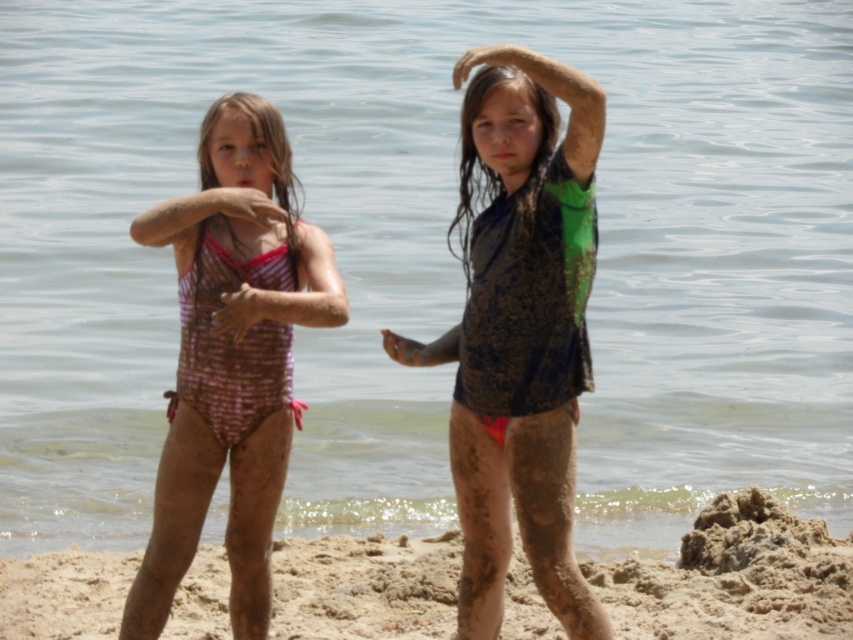
Can you confirm if shiny green and black swimsuit at center is positioned above fine-grained sand at lower center?

Indeed, shiny green and black swimsuit at center is positioned over fine-grained sand at lower center.

At what (x,y) coordinates should I click in order to perform the action: click on shiny green and black swimsuit at center. Please return your answer as a coordinate pair (x, y). Image resolution: width=853 pixels, height=640 pixels. Looking at the image, I should click on (520, 330).

This screenshot has width=853, height=640. Describe the element at coordinates (520, 330) in the screenshot. I see `shiny green and black swimsuit at center` at that location.

Image resolution: width=853 pixels, height=640 pixels. Identify the location of shiny green and black swimsuit at center. (520, 330).

Image resolution: width=853 pixels, height=640 pixels. What do you see at coordinates (735, 577) in the screenshot?
I see `fine-grained sand at lower center` at bounding box center [735, 577].

Is fine-grained sand at lower center behind pink checkered swimsuit at center?

Yes, fine-grained sand at lower center is behind pink checkered swimsuit at center.

Describe the element at coordinates (735, 577) in the screenshot. I see `fine-grained sand at lower center` at that location.

Image resolution: width=853 pixels, height=640 pixels. What are the coordinates of `fine-grained sand at lower center` in the screenshot? It's located at (735, 577).

Who is positioned more to the left, shiny green and black swimsuit at center or pink checkered swimsuit at center?

pink checkered swimsuit at center is more to the left.

Is point (546, 180) less distant than point (248, 314)?

Yes, point (546, 180) is in front of point (248, 314).

Does point (502, 484) lie behind point (247, 588)?

No.

You are a GUI agent. You are given a task and a screenshot of the screen. Output one action in this format:
    pyautogui.click(x=<x>, y=<y>)
    Task: Click on the shiny green and black swimsuit at center
    The height and width of the screenshot is (640, 853).
    Given the screenshot: What is the action you would take?
    pyautogui.click(x=520, y=330)